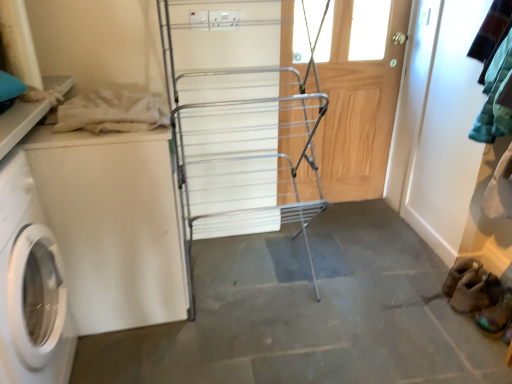
Image resolution: width=512 pixels, height=384 pixels. What are the coordinates of `vacant space situated above gray concrete floor at center (from a real-world perspective)` in the screenshot? It's located at (309, 308).